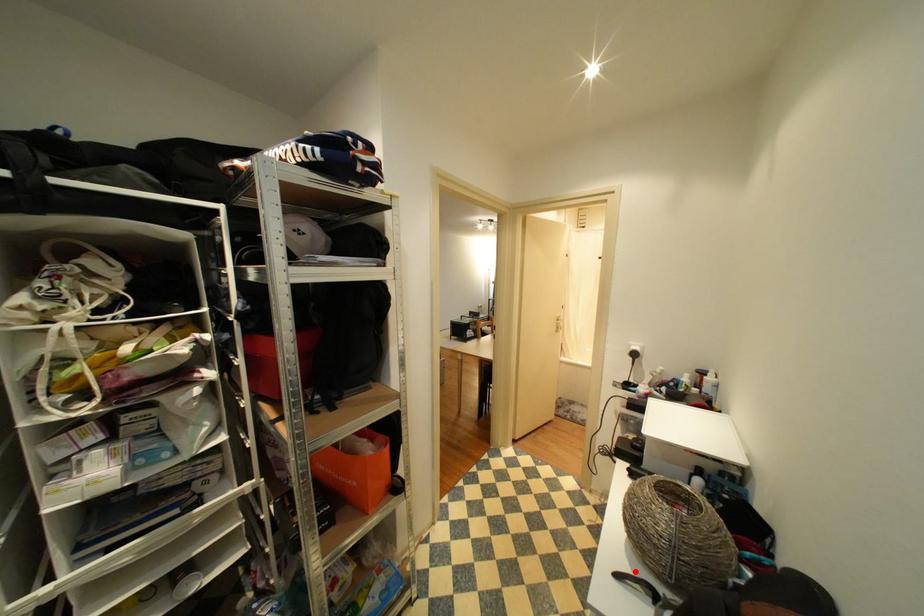
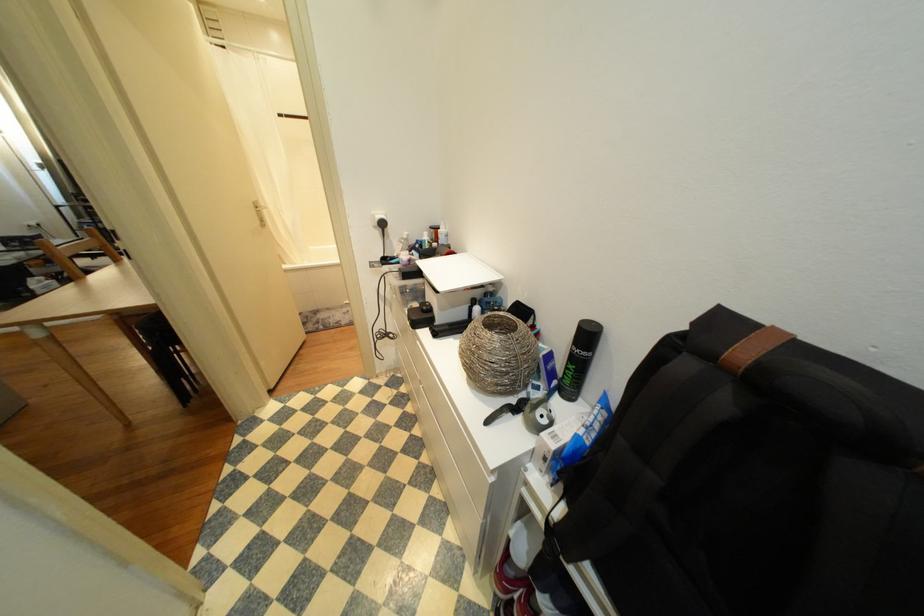
Where in the second image is the point corresponding to the highlighted location from the first image?

(496, 411)